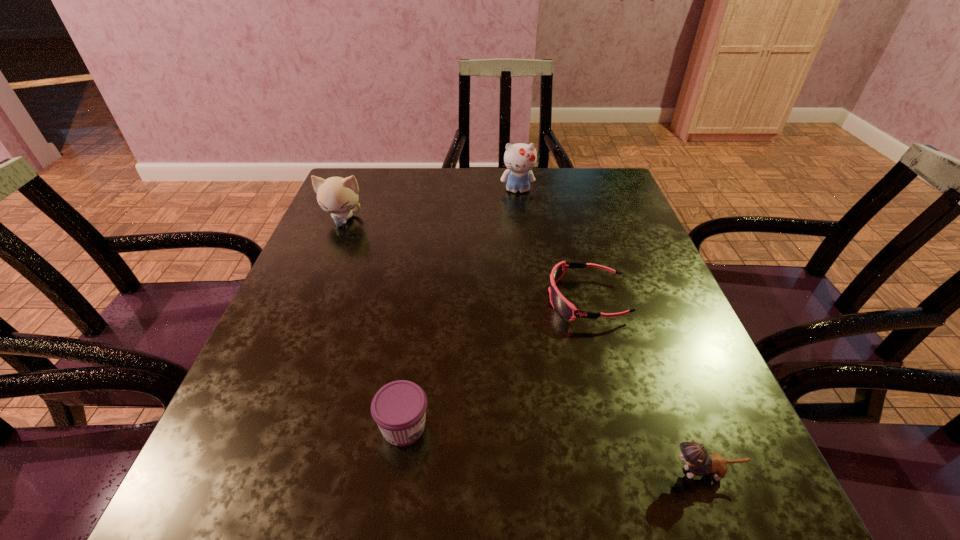
This screenshot has width=960, height=540. In the image, there is a desktop. Identify the location of blank space at the far right corner. (596, 193).

The image size is (960, 540). In order to click on unoccupied area between the farthest object and the nearest kitten in this screenshot , I will do `click(611, 332)`.

Find the location of a particular element. free space between the jam and the shortest object is located at coordinates (495, 363).

Where is `free space between the third nearest object and the second nearest object`? Image resolution: width=960 pixels, height=540 pixels. free space between the third nearest object and the second nearest object is located at coordinates (495, 363).

Locate an element on the screen. Image resolution: width=960 pixels, height=540 pixels. unoccupied area between the farthest object and the jam is located at coordinates (461, 308).

The image size is (960, 540). I want to click on vacant region between the leftmost kitten and the third farthest object, so click(x=465, y=259).

Where is `vacant area between the goggles and the farthest kitten`? vacant area between the goggles and the farthest kitten is located at coordinates (552, 245).

This screenshot has height=540, width=960. Find the location of `vacant space that's between the farthest object and the leftmost object`. vacant space that's between the farthest object and the leftmost object is located at coordinates (430, 205).

Locate an element on the screen. vacant region between the nearest object and the third farthest object is located at coordinates (645, 386).

This screenshot has width=960, height=540. I want to click on vacant region between the second farthest kitten and the nearest kitten, so pos(523,346).